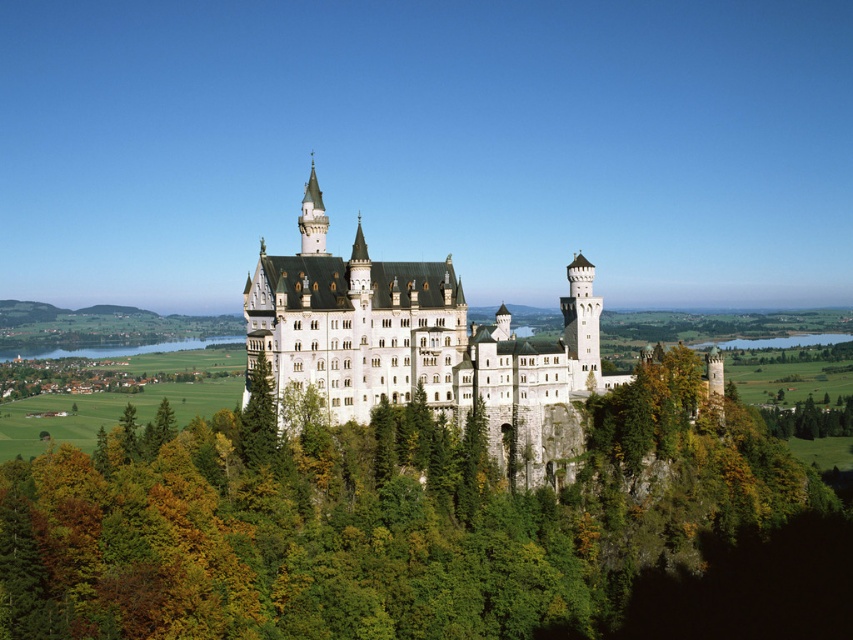
Is green leafy tree at center further to the viewer compared to white stone castle at center?

No, green leafy tree at center is closer to the viewer.

Does green leafy tree at center appear on the left side of white stone castle at center?

In fact, green leafy tree at center is to the right of white stone castle at center.

This screenshot has width=853, height=640. What do you see at coordinates (424, 529) in the screenshot?
I see `green leafy tree at center` at bounding box center [424, 529].

Image resolution: width=853 pixels, height=640 pixels. I want to click on green leafy tree at center, so click(x=424, y=529).